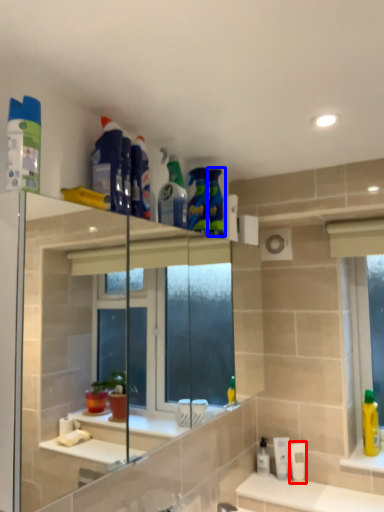
Question: Which point is further to the camera, mouthwash (highlighted by a red box) or cleaning product (highlighted by a blue box)?

Choices:
 (A) mouthwash
 (B) cleaning product

Answer: (A)